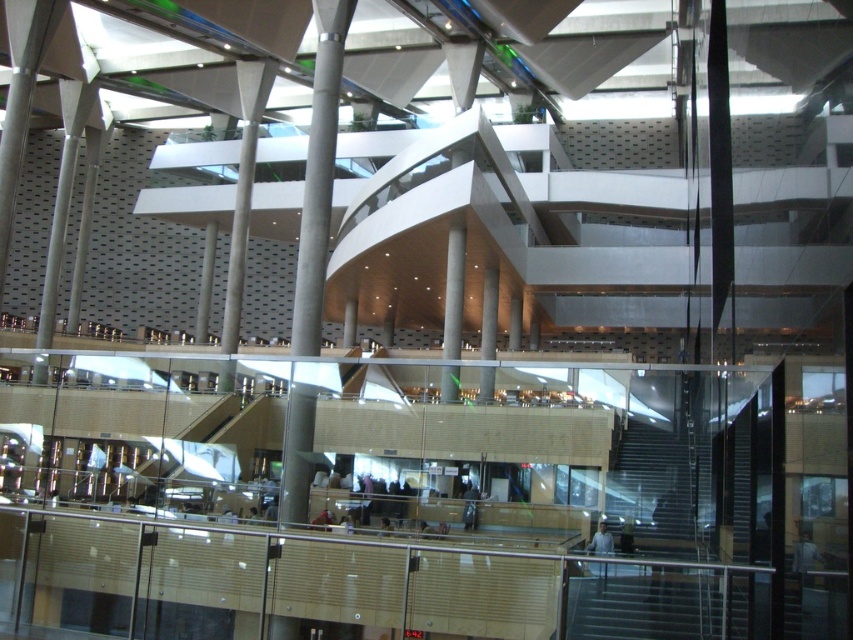
Question: Is smooth concrete pillar at center closer to the viewer compared to satin gray column at center?

Choices:
 (A) no
 (B) yes

Answer: (A)

Question: Which point is farther to the camera?

Choices:
 (A) [457, 301]
 (B) [486, 272]
 (C) [329, 195]

Answer: (B)

Question: Can you confirm if concrete column at center is positioned to the left of smooth concrete pillar at center?

Choices:
 (A) no
 (B) yes

Answer: (B)

Question: Among these points, which one is farthest from the camera?

Choices:
 (A) (480, 321)
 (B) (453, 227)
 (C) (311, 260)

Answer: (A)

Question: Is smooth concrete pillar at center wider than satin gray column at center?

Choices:
 (A) no
 (B) yes

Answer: (A)

Question: Which point is closer to the camera taking this photo?

Choices:
 (A) (300, 280)
 (B) (488, 317)
 (C) (450, 252)

Answer: (A)